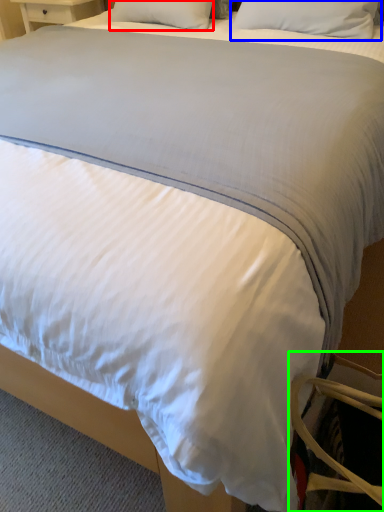
Question: Estimate the real-world distances between objects in this image. Which object is farther from pillow (highlighted by a red box), pillow (highlighted by a blue box) or swivel chair (highlighted by a green box)?

Choices:
 (A) pillow
 (B) swivel chair

Answer: (B)